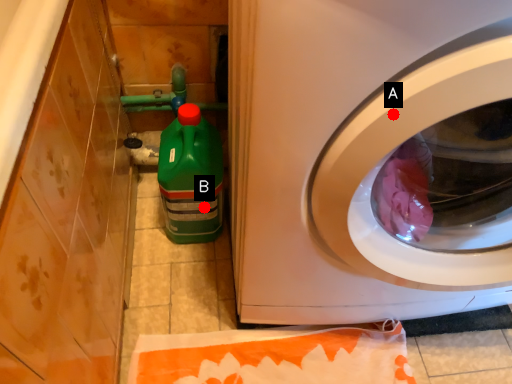
Question: Two points are circled on the image, labeled by A and B beside each circle. Among these points, which one is nearest to the camera?

Choices:
 (A) A is closer
 (B) B is closer

Answer: (A)